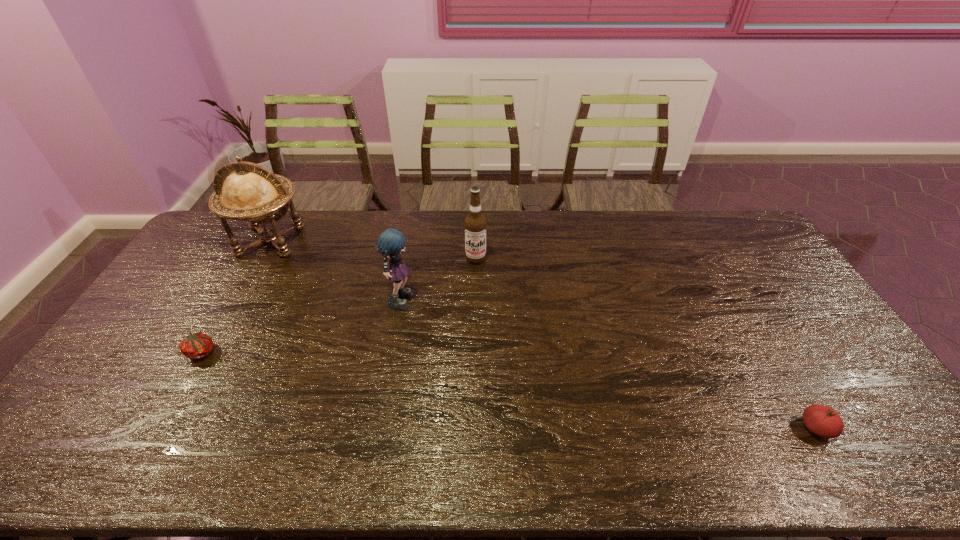
Identify the location of vacant area situated 0.160m on the front-facing side of the third object from left to right. Image resolution: width=960 pixels, height=540 pixels. click(x=465, y=296).

Locate an element on the screen. vacant space located 0.160m on the right of the right tomato is located at coordinates click(x=898, y=428).

Where is `vacant space located on the back of the shorter tomato`? This screenshot has height=540, width=960. vacant space located on the back of the shorter tomato is located at coordinates (239, 288).

This screenshot has height=540, width=960. Find the location of `object that is at the far edge`. object that is at the far edge is located at coordinates (251, 192).

Where is `object at the near edge`? Image resolution: width=960 pixels, height=540 pixels. object at the near edge is located at coordinates (824, 421).

At what (x,y) coordinates should I click in order to perform the action: click on object that is at the left edge. Please return your answer as a coordinate pair (x, y). The width and height of the screenshot is (960, 540). Looking at the image, I should click on (251, 192).

In order to click on object located at the right edge in this screenshot , I will do `click(824, 421)`.

Identify the location of object that is at the far left corner. The width and height of the screenshot is (960, 540). pyautogui.click(x=251, y=192).

You are a GUI agent. You are given a task and a screenshot of the screen. Output one action in this format:
    pyautogui.click(x=<x>, y=<y>)
    Task: Click on the object that is at the near right corner
    
    Given the screenshot: What is the action you would take?
    pyautogui.click(x=824, y=421)

Where is `free location at the far edge`? This screenshot has width=960, height=540. free location at the far edge is located at coordinates (574, 244).